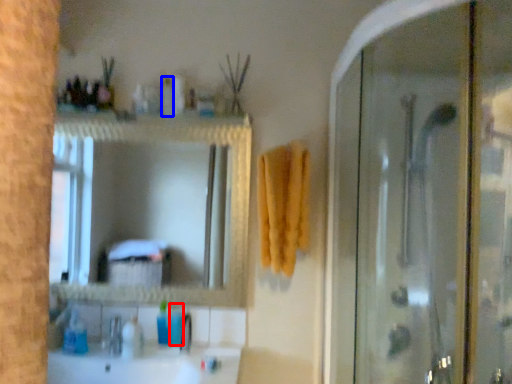
Question: Among these objects, which one is farthest to the camera, toiletry (highlighted by a red box) or toiletry (highlighted by a blue box)?

Choices:
 (A) toiletry
 (B) toiletry

Answer: (A)